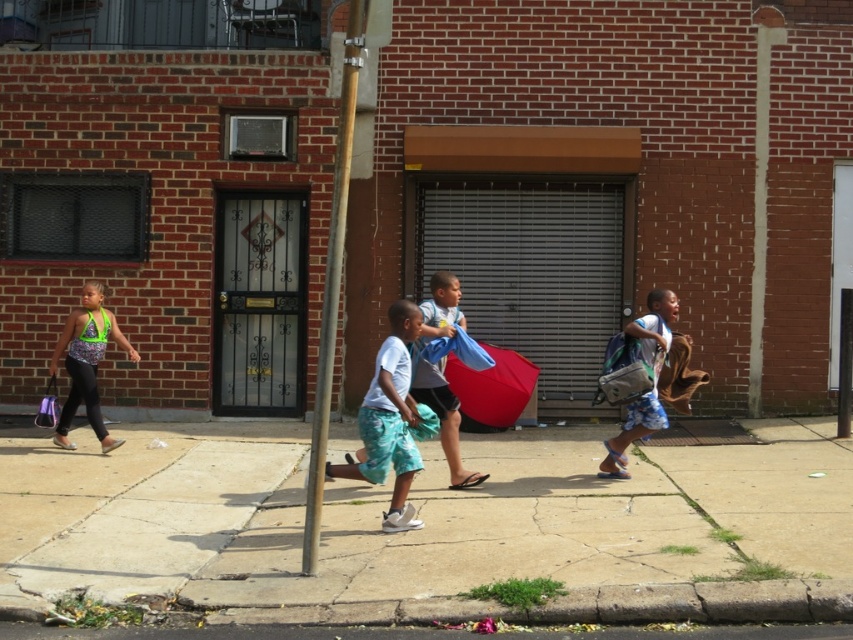
Is point (303, 604) behind point (283, 376)?

No, it is in front of (283, 376).

Which is more to the left, smooth concrete sidewalk at center or black metal/gate at center?

black metal/gate at center is more to the left.

Is point (764, 499) farther from viewer compared to point (212, 404)?

No, it is in front of (212, 404).

At what (x,y) coordinates should I click in order to perform the action: click on smooth concrete sidewalk at center. Please return your answer as a coordinate pair (x, y). Looking at the image, I should click on (485, 529).

Can you confirm if smooth concrete sidewalk at center is smaller than blue denim shorts at right?

Yes.

Is point (598, 577) positioned after point (650, 296)?

No, (598, 577) is closer to viewer.

Which is behind, point (805, 481) or point (653, 324)?

Positioned behind is point (805, 481).

This screenshot has height=640, width=853. Find the location of `smooth concrete sidewalk at center`. smooth concrete sidewalk at center is located at coordinates (485, 529).

From the picture: Which is below, metallic gray garage door at center or matte purple shopping bag at lower left?

matte purple shopping bag at lower left

Find the location of a particular element. This screenshot has width=853, height=640. metallic gray garage door at center is located at coordinates (534, 272).

Is point (566, 413) positioned in front of point (49, 385)?

No, (566, 413) is further to viewer.

Where is `metallic gray garage door at center`? This screenshot has width=853, height=640. metallic gray garage door at center is located at coordinates (534, 272).